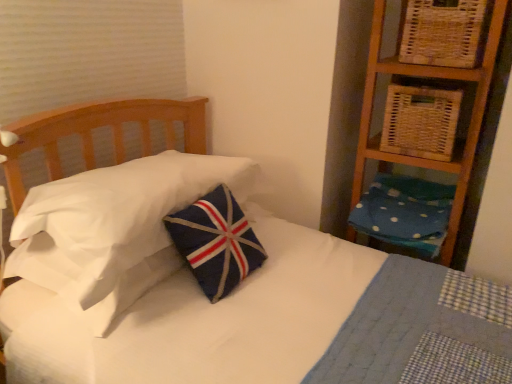
Question: Is woven natural basket at upper right, which is counted as the first basket, starting from the bottom, located outside navy felt pillow at center, which is the second pillow from right to left?

Choices:
 (A) no
 (B) yes

Answer: (B)

Question: From the image's perspective, would you say woven natural basket at upper right, the second basket viewed from the top, is positioned over navy felt pillow at center, the first pillow in the left-to-right sequence?

Choices:
 (A) no
 (B) yes

Answer: (B)

Question: Are woven natural basket at upper right, the second basket viewed from the top, and navy felt pillow at center, which is the second pillow from right to left, located far from each other?

Choices:
 (A) yes
 (B) no

Answer: (B)

Question: Does woven natural basket at upper right, the second basket viewed from the top, have a greater height compared to navy felt pillow at center, the first pillow in the left-to-right sequence?

Choices:
 (A) yes
 (B) no

Answer: (A)

Question: From the image's perspective, would you say woven natural basket at upper right, which is counted as the first basket, starting from the bottom, is shown under navy felt pillow at center, which is the second pillow from right to left?

Choices:
 (A) yes
 (B) no

Answer: (B)

Question: Is woven natural basket at upper right, which is counted as the first basket, starting from the bottom, behind navy felt pillow at center, which is the second pillow from right to left?

Choices:
 (A) yes
 (B) no

Answer: (A)

Question: Is woven wicker basket at upper right, marked as the second basket in a bottom-to-top arrangement, turned away from woven natural basket at upper right, which is counted as the first basket, starting from the bottom?

Choices:
 (A) yes
 (B) no

Answer: (B)

Question: Is woven wicker basket at upper right, marked as the second basket in a bottom-to-top arrangement, surrounding woven natural basket at upper right, which is counted as the first basket, starting from the bottom?

Choices:
 (A) yes
 (B) no

Answer: (B)

Question: Is woven wicker basket at upper right, the first basket viewed from the top, at the left side of woven natural basket at upper right, the second basket viewed from the top?

Choices:
 (A) no
 (B) yes

Answer: (A)

Question: Does woven wicker basket at upper right, marked as the second basket in a bottom-to-top arrangement, have a greater width compared to woven natural basket at upper right, which is counted as the first basket, starting from the bottom?

Choices:
 (A) yes
 (B) no

Answer: (B)

Question: From the image's perspective, is woven wicker basket at upper right, the first basket viewed from the top, located above woven natural basket at upper right, the second basket viewed from the top?

Choices:
 (A) no
 (B) yes

Answer: (B)

Question: From a real-world perspective, is woven wicker basket at upper right, the first basket viewed from the top, located beneath woven natural basket at upper right, the second basket viewed from the top?

Choices:
 (A) yes
 (B) no

Answer: (B)

Question: Is woven natural basket at upper right, the second basket viewed from the top, turned away from blue dotted fabric pillow at right, the first pillow viewed from the right?

Choices:
 (A) no
 (B) yes

Answer: (A)